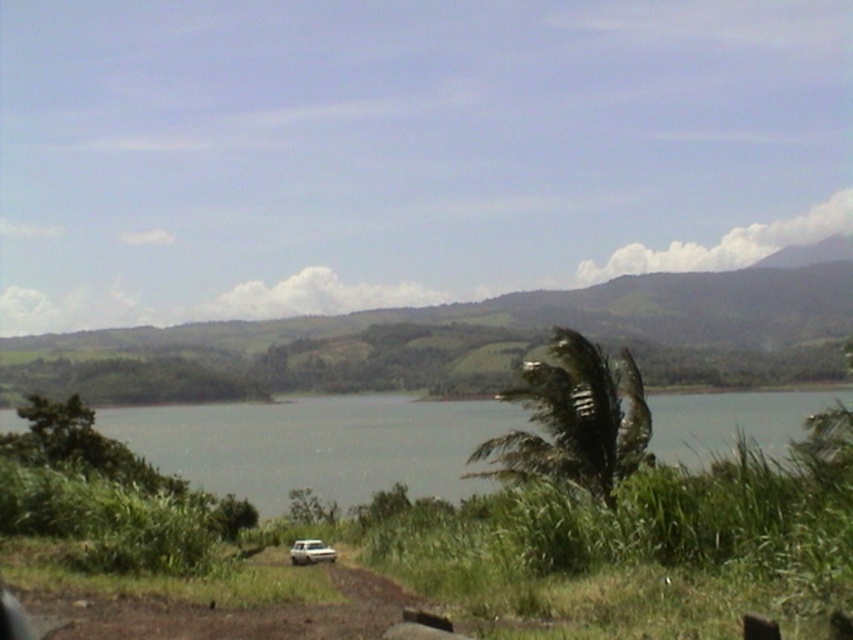
Can you confirm if brown dirt track at lower center is bigger than white matte car at lower center?

Correct, brown dirt track at lower center is larger in size than white matte car at lower center.

Can you confirm if brown dirt track at lower center is positioned above white matte car at lower center?

Yes.

You are a GUI agent. You are given a task and a screenshot of the screen. Output one action in this format:
    pyautogui.click(x=<x>, y=<y>)
    Task: Click on the brown dirt track at lower center
    
    Given the screenshot: What is the action you would take?
    tap(212, 602)

I want to click on brown dirt track at lower center, so click(212, 602).

Is point (755, 300) positioned after point (686, 410)?

Yes, point (755, 300) is behind point (686, 410).

Between point (782, 317) and point (819, 403), which one is positioned in front?

Point (819, 403) is more forward.

Is point (733, 285) positioned in front of point (724, 422)?

No.

Image resolution: width=853 pixels, height=640 pixels. Find the location of `green grassy hill at center`. green grassy hill at center is located at coordinates (471, 340).

Can you confirm if green grassy hill at center is positioned below brown dirt track at lower center?

No, green grassy hill at center is not below brown dirt track at lower center.

Is point (183, 353) closer to camera compared to point (210, 625)?

No.

Find the location of a particular element. The image size is (853, 640). green grassy hill at center is located at coordinates (471, 340).